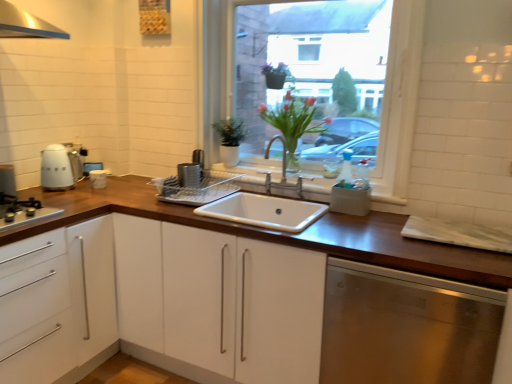
Where is `free spot above matte white kettle at left (from a real-world perspective)`? The height and width of the screenshot is (384, 512). free spot above matte white kettle at left (from a real-world perspective) is located at coordinates (58, 146).